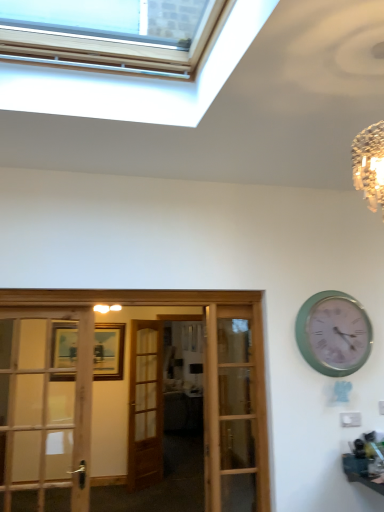
Question: Can you confirm if velvet brown couch at center is bigger than wooden door at center?

Choices:
 (A) no
 (B) yes

Answer: (B)

Question: Is the surface of velvet brown couch at center in direct contact with wooden door at center?

Choices:
 (A) no
 (B) yes

Answer: (A)

Question: Is velvet brown couch at center turned away from wooden door at center?

Choices:
 (A) no
 (B) yes

Answer: (A)

Question: Is velvet brown couch at center at the right side of wooden door at center?

Choices:
 (A) no
 (B) yes

Answer: (B)

Question: Can you confirm if velvet brown couch at center is taller than wooden door at center?

Choices:
 (A) no
 (B) yes

Answer: (A)

Question: Can you confirm if velvet brown couch at center is wider than wooden door at center?

Choices:
 (A) no
 (B) yes

Answer: (B)

Question: Considering the relative positions of velvet brown couch at center and green metallic clock at upper right in the image provided, is velvet brown couch at center to the right of green metallic clock at upper right from the viewer's perspective?

Choices:
 (A) yes
 (B) no

Answer: (B)

Question: Does velvet brown couch at center come behind green metallic clock at upper right?

Choices:
 (A) yes
 (B) no

Answer: (A)

Question: Can you confirm if velvet brown couch at center is thinner than green metallic clock at upper right?

Choices:
 (A) no
 (B) yes

Answer: (A)

Question: Does velvet brown couch at center turn towards green metallic clock at upper right?

Choices:
 (A) yes
 (B) no

Answer: (B)

Question: Is velvet brown couch at center positioned far away from green metallic clock at upper right?

Choices:
 (A) yes
 (B) no

Answer: (A)

Question: From the image's perspective, would you say velvet brown couch at center is shown under green metallic clock at upper right?

Choices:
 (A) no
 (B) yes

Answer: (B)

Question: Can you confirm if velvet brown couch at center is taller than wooden french doors at center?

Choices:
 (A) yes
 (B) no

Answer: (B)